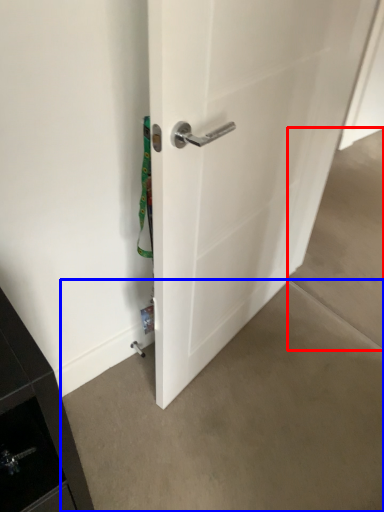
Question: Among these objects, which one is nearest to the camera, concrete (highlighted by a red box) or concrete (highlighted by a blue box)?

Choices:
 (A) concrete
 (B) concrete

Answer: (B)